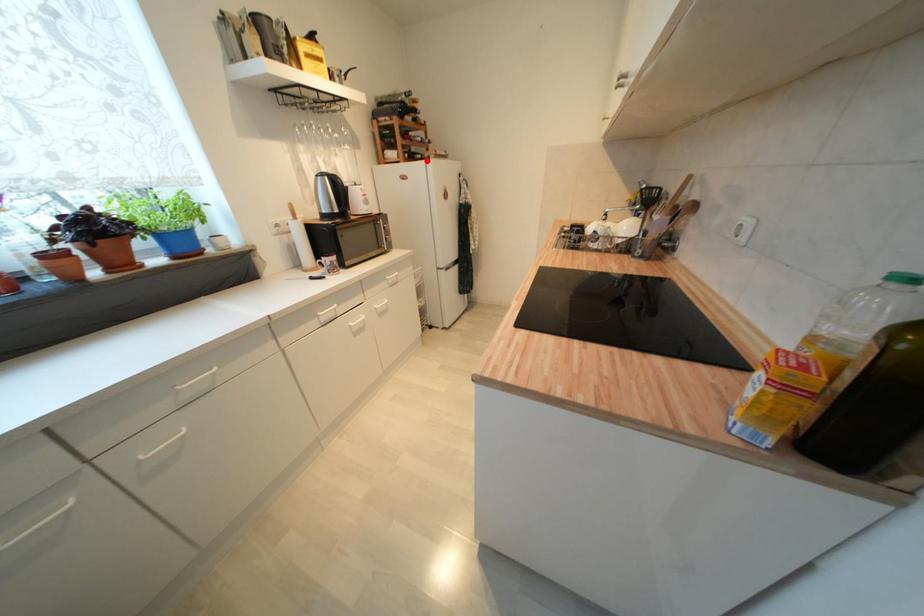
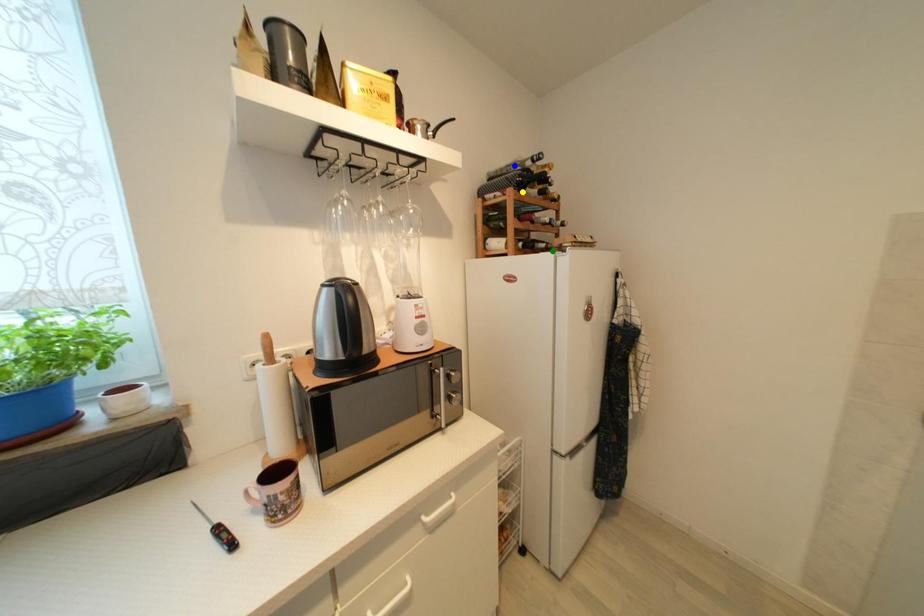
Question: I am providing you with two images of the same scene from different viewpoints. A red point is marked on the first image. You are given multiple points on the second image. Which mark in image 2 goes with the point in image 1?

Choices:
 (A) yellow point
 (B) green point
 (C) blue point

Answer: (B)